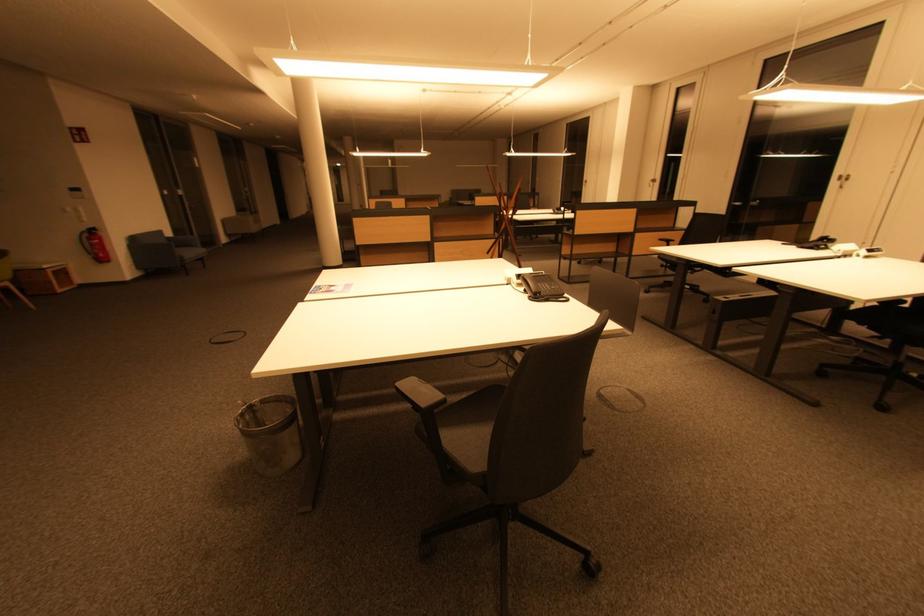
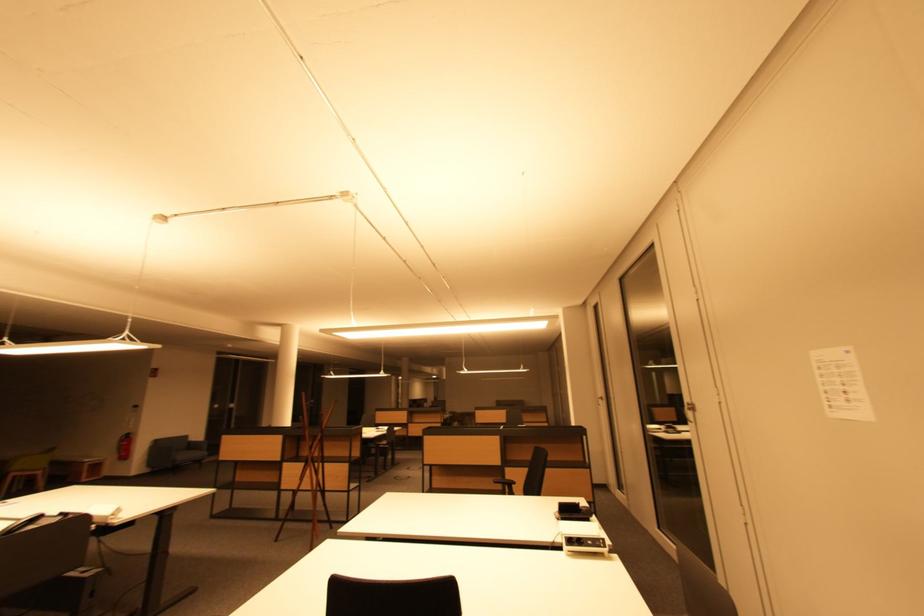
The point at [659,183] is marked in the first image. Where is the corresponding point in the second image?

(605, 400)